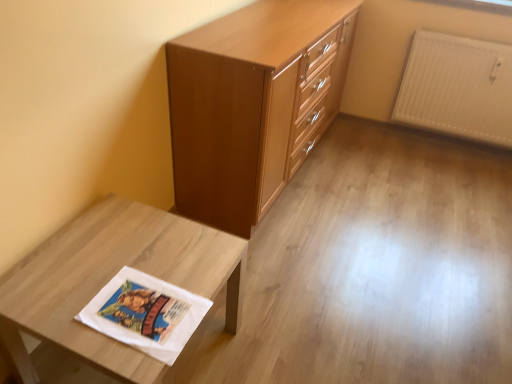
Find the location of a particular element. vacant space that is in between matte wood chest of drawers at center and white textured radiator at upper right is located at coordinates (380, 173).